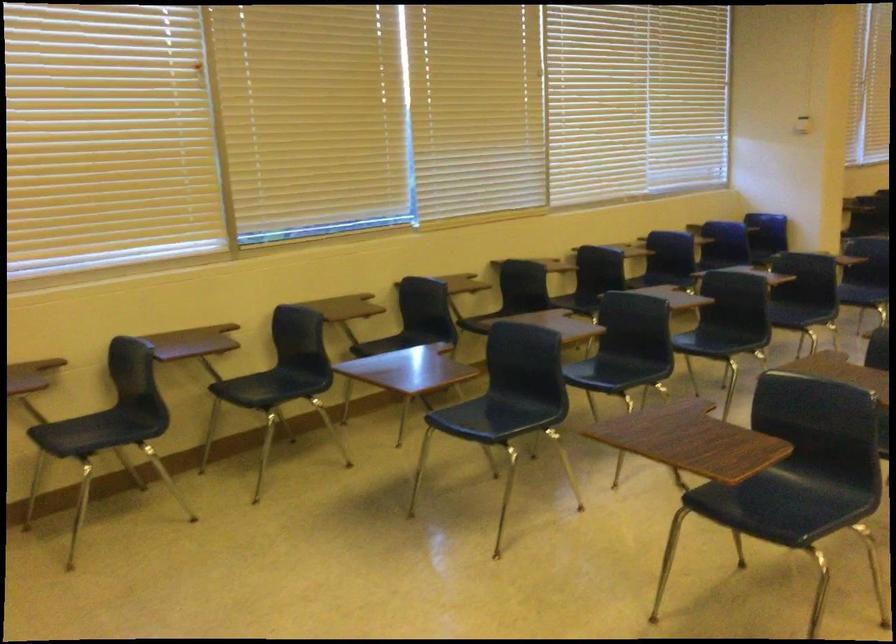
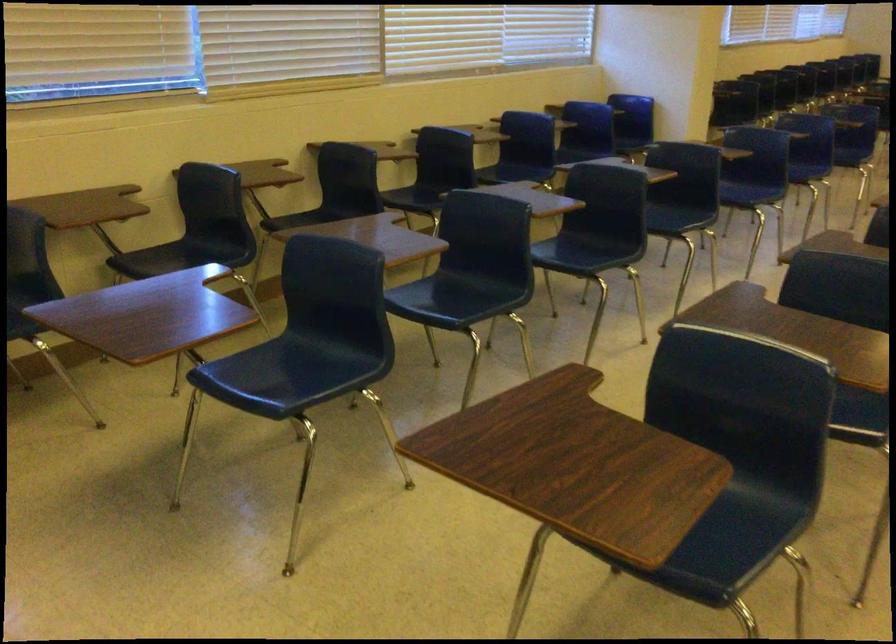
The point at (x=400, y=341) is marked in the first image. Where is the corresponding point in the second image?

(181, 257)